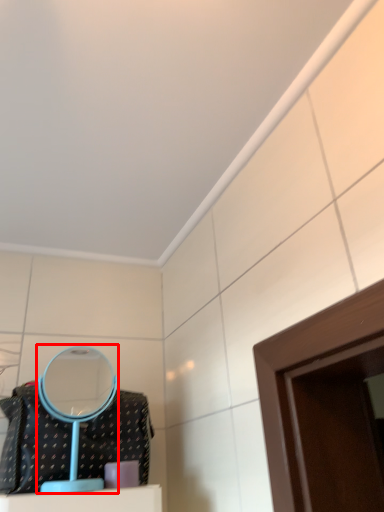
Question: Where is mirror (annotated by the red box) located in relation to clothing in the image?

Choices:
 (A) right
 (B) left

Answer: (A)